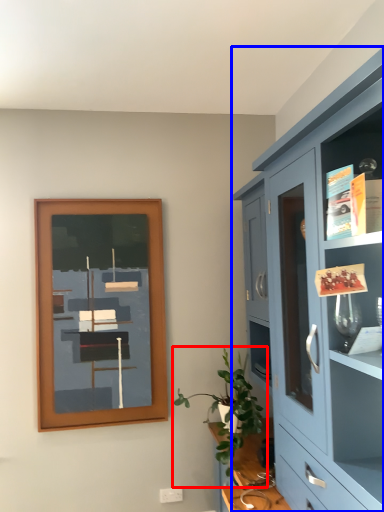
Question: Which point is closer to the camera, houseplant (highlighted by a red box) or cabinetry (highlighted by a blue box)?

Choices:
 (A) houseplant
 (B) cabinetry

Answer: (B)